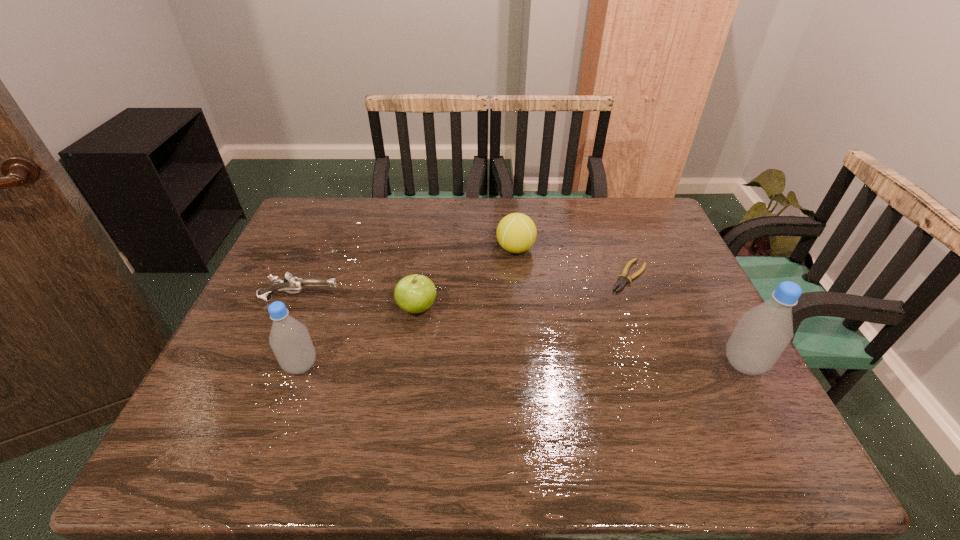
Identify the location of free location located on the back of the right bottle. (726, 332).

The width and height of the screenshot is (960, 540). Identify the location of vacant space positioned on the left of the third object from right to left. (473, 249).

This screenshot has height=540, width=960. Find the location of `free space located on the left of the apple`. free space located on the left of the apple is located at coordinates (367, 308).

At what (x,y) coordinates should I click in order to perform the action: click on vacant space situated 0.260m on the back of the shortest object. Please return your answer as a coordinate pair (x, y). Looking at the image, I should click on (605, 212).

Where is `vacant space situated aimed along the barrel of the second shortest object`? vacant space situated aimed along the barrel of the second shortest object is located at coordinates (454, 299).

Identify the location of object that is at the far edge. (516, 233).

This screenshot has height=540, width=960. Identify the location of object that is at the near edge. (763, 332).

The width and height of the screenshot is (960, 540). In order to click on bottle located in the left edge section of the desktop in this screenshot , I will do `click(289, 339)`.

This screenshot has height=540, width=960. Identify the location of gun positioned at the left edge. (290, 283).

The height and width of the screenshot is (540, 960). Identify the location of bottle located at the right edge. (763, 332).